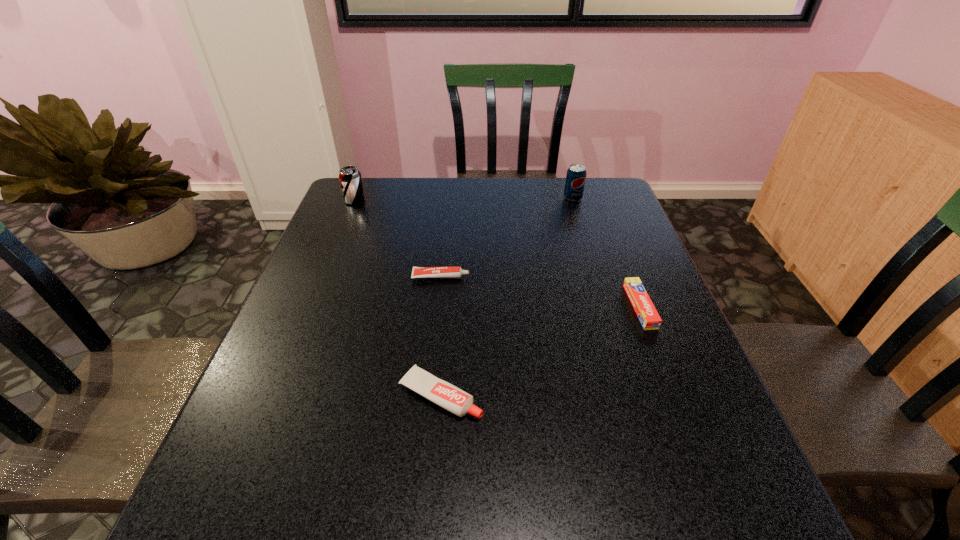
The width and height of the screenshot is (960, 540). I want to click on vacant space situated 0.330m at the nozzle of the farthest toothpaste, so click(596, 276).

The width and height of the screenshot is (960, 540). Find the location of `vacant space located on the back of the second nearest object`. vacant space located on the back of the second nearest object is located at coordinates (608, 223).

This screenshot has width=960, height=540. In order to click on object present at the left edge in this screenshot , I will do `click(350, 178)`.

Identify the location of soda can that is at the right edge. This screenshot has height=540, width=960. (576, 174).

This screenshot has width=960, height=540. I want to click on toothpaste that is at the right edge, so click(x=650, y=320).

This screenshot has width=960, height=540. In order to click on object located in the far left corner section of the desktop in this screenshot , I will do `click(350, 178)`.

Image resolution: width=960 pixels, height=540 pixels. I want to click on object present at the far right corner, so click(x=576, y=174).

Locate an element on the screen. This screenshot has width=960, height=540. free space at the far edge is located at coordinates (495, 185).

Where is `blank area at the near edge`? This screenshot has width=960, height=540. blank area at the near edge is located at coordinates (513, 537).

Identify the location of vacant space at the left edge of the desktop. The image size is (960, 540). (323, 359).